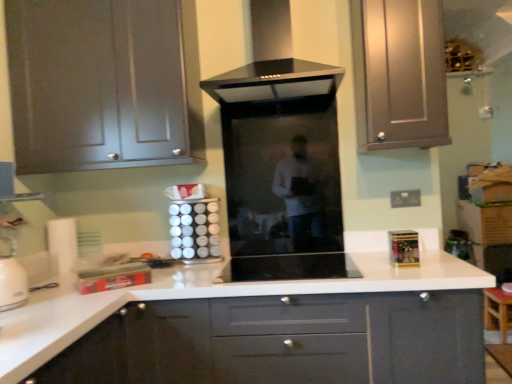
Question: Does black glass range hood at center touch white glossy canisters at center, the 2th appliance from the left?

Choices:
 (A) no
 (B) yes

Answer: (A)

Question: From the image's perspective, is black glass range hood at center below white glossy canisters at center, the 3th appliance positioned from the right?

Choices:
 (A) yes
 (B) no

Answer: (B)

Question: Is black glass range hood at center wider than white glossy canisters at center, the 2th appliance from the left?

Choices:
 (A) yes
 (B) no

Answer: (A)

Question: Can you confirm if black glass range hood at center is thinner than white glossy canisters at center, the 3th appliance positioned from the right?

Choices:
 (A) no
 (B) yes

Answer: (A)

Question: From a real-world perspective, is black glass range hood at center below white glossy canisters at center, the 3th appliance positioned from the right?

Choices:
 (A) no
 (B) yes

Answer: (A)

Question: From a real-world perspective, is black glass range hood at center positioned over white glossy canisters at center, the 2th appliance from the left, based on gravity?

Choices:
 (A) yes
 (B) no

Answer: (A)

Question: Is satin silver cabinet at upper right, acting as the second cabinetry starting from the bottom, completely or partially inside metallic silver toaster at lower left, the first appliance when ordered from left to right?

Choices:
 (A) yes
 (B) no

Answer: (B)

Question: Does metallic silver toaster at lower left, the first appliance when ordered from left to right, have a smaller size compared to satin silver cabinet at upper right, acting as the second cabinetry starting from the bottom?

Choices:
 (A) no
 (B) yes

Answer: (B)

Question: From the image's perspective, is metallic silver toaster at lower left, the first appliance when ordered from left to right, beneath satin silver cabinet at upper right, positioned as the second cabinetry in top-to-bottom order?

Choices:
 (A) no
 (B) yes

Answer: (B)

Question: Considering the relative positions of metallic silver toaster at lower left, the first appliance when ordered from left to right, and satin silver cabinet at upper right, positioned as the second cabinetry in top-to-bottom order, in the image provided, is metallic silver toaster at lower left, the first appliance when ordered from left to right, to the right of satin silver cabinet at upper right, positioned as the second cabinetry in top-to-bottom order, from the viewer's perspective?

Choices:
 (A) yes
 (B) no

Answer: (B)

Question: Considering the relative sizes of metallic silver toaster at lower left, which is the 4th appliance in right-to-left order, and satin silver cabinet at upper right, positioned as the second cabinetry in top-to-bottom order, in the image provided, is metallic silver toaster at lower left, which is the 4th appliance in right-to-left order, thinner than satin silver cabinet at upper right, positioned as the second cabinetry in top-to-bottom order,?

Choices:
 (A) no
 (B) yes

Answer: (B)

Question: From the image's perspective, is metallic silver toaster at lower left, the first appliance when ordered from left to right, above satin silver cabinet at upper right, acting as the second cabinetry starting from the bottom?

Choices:
 (A) yes
 (B) no

Answer: (B)

Question: Is metallic silver toaster at lower left, which is the 4th appliance in right-to-left order, completely or partially inside black glass range hood at center?

Choices:
 (A) no
 (B) yes

Answer: (A)